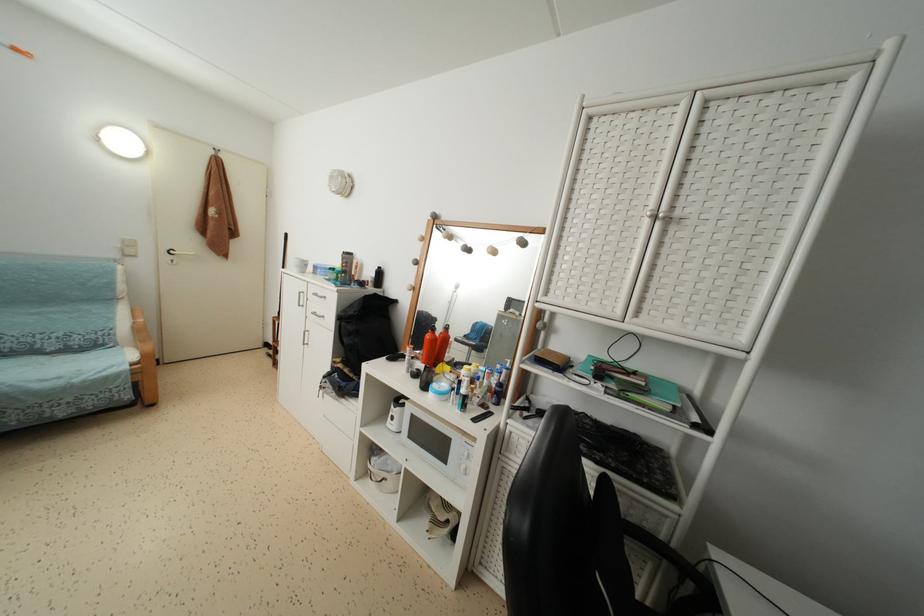
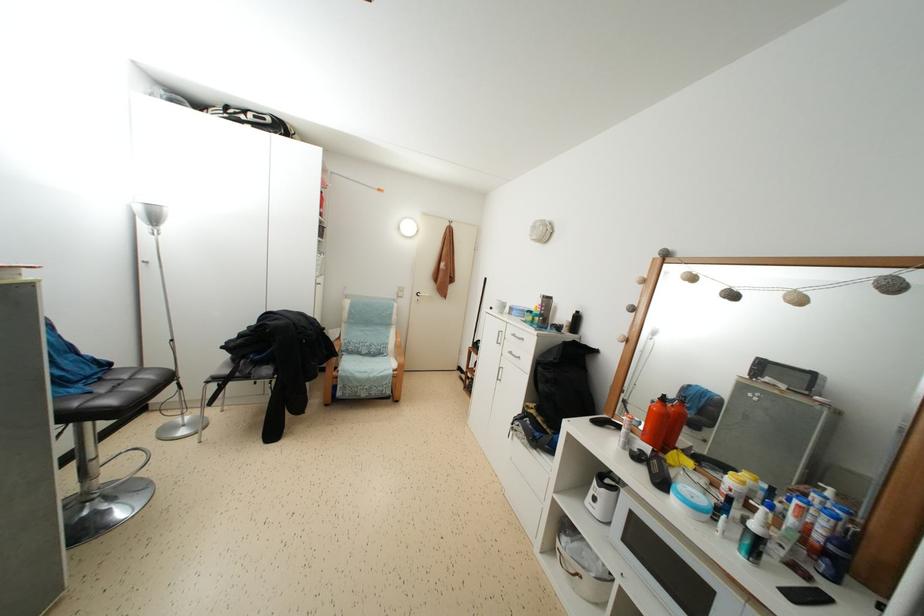
Locate, in the second image, the point that corresponds to the point at 193,248 in the first image.

(432, 293)